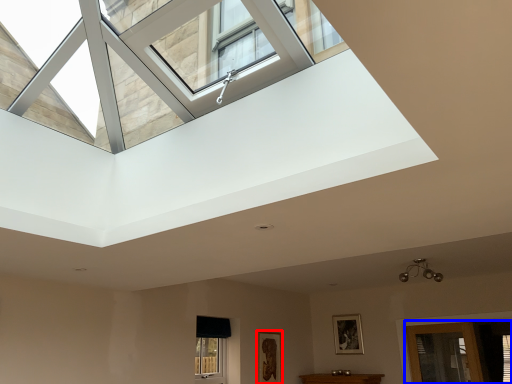
Question: Which object is further to the camera taking this photo, picture frame (highlighted by a red box) or glass door (highlighted by a blue box)?

Choices:
 (A) picture frame
 (B) glass door

Answer: (A)